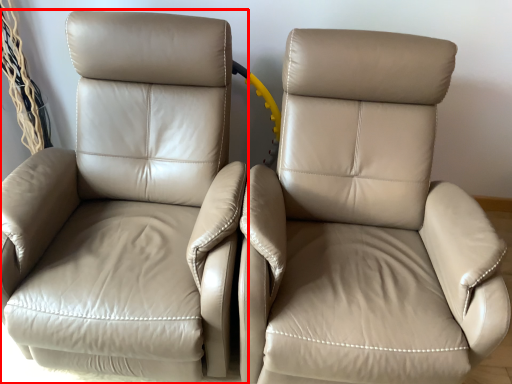
Question: From the image's perspective, what is the correct spatial relationship of chair (annotated by the red box) in relation to chair?

Choices:
 (A) above
 (B) below

Answer: (A)